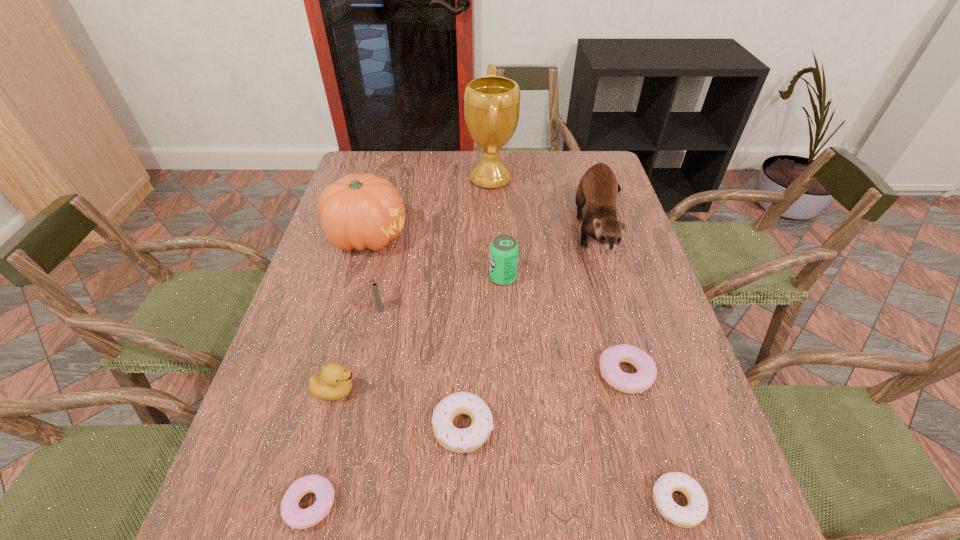
You are a GUI agent. You are given a task and a screenshot of the screen. Output one action in this format:
    pyautogui.click(x=<x>, y=<y>)
    Task: Click on the free point that satisfies the following two spatial constraints: 1. on the carved face of the bigger pink doughnut; 2. on the left side of the pumpkin
    The width and height of the screenshot is (960, 540).
    Given the screenshot: What is the action you would take?
    pyautogui.click(x=329, y=374)

This screenshot has height=540, width=960. I want to click on free location that satisfies the following two spatial constraints: 1. at the face of the ferret; 2. on the front-facing side of the pop soda, so click(619, 278).